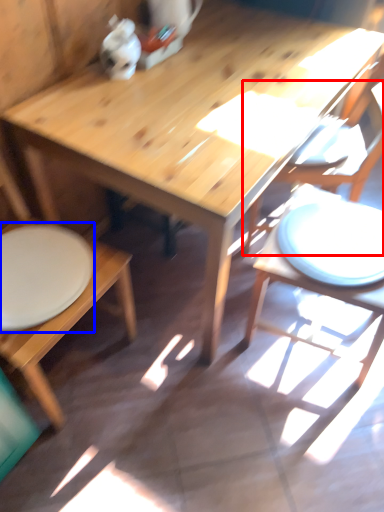
Question: Which of the following is the closest to the observer, chair (highlighted by a red box) or plate (highlighted by a blue box)?

Choices:
 (A) chair
 (B) plate

Answer: (B)